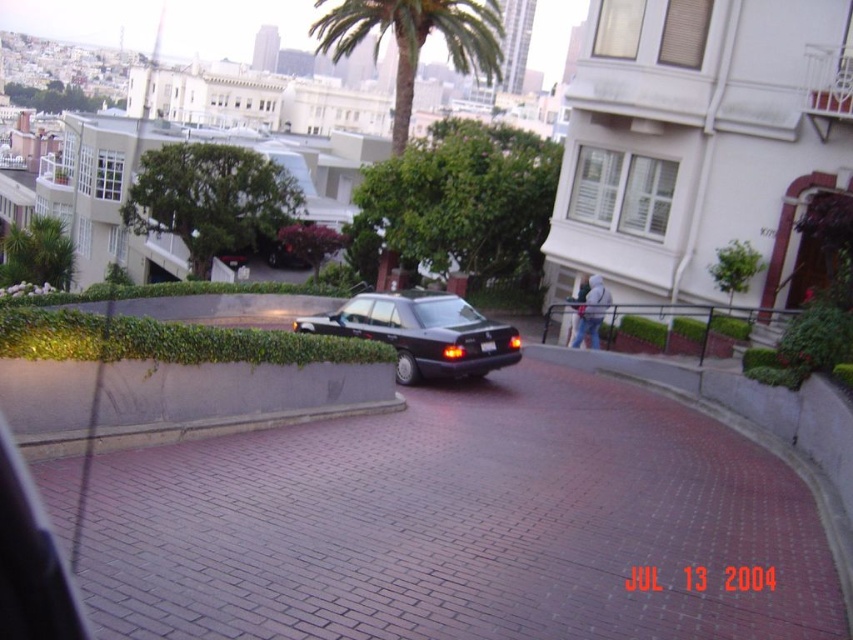
You are a delivery person trying to attach a package to the roof of the satin black sedan at center. The package is 30 cm tall. Can you safely place it there without it touching the black plastic license plate at center?

The satin black sedan at center has a greater height compared to the black plastic license plate at center. Since the sedan is taller, the license plate is likely positioned lower on the vehicle. The package at 30 cm tall can be placed on the roof as it won t interfere with the lower positioned license plate.

You are standing at the bottom of the steep street in San Francisco and want to take a photo of the green leafy palm tree at upper center. Based on its 2D coordinates, where should you aim your camera?

The green leafy palm tree at upper center is located at coordinates (415, 40), so you should aim your camera towards the upper center area of the frame to capture it.